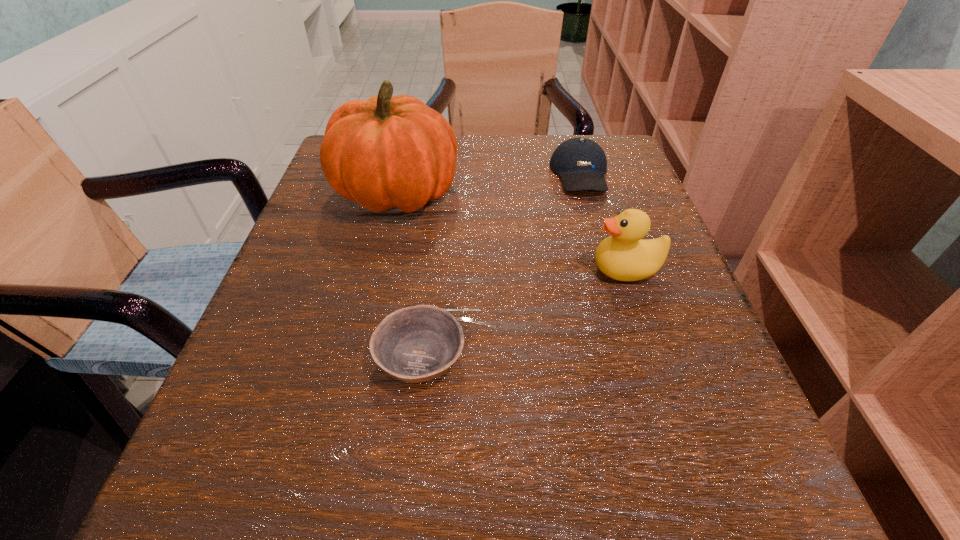
Locate an element on the screen. free space at the near edge is located at coordinates (396, 470).

Find the location of a particular element. This screenshot has width=960, height=540. vacant region at the left edge of the desktop is located at coordinates (287, 332).

In the image, there is a desktop. At what (x,y) coordinates should I click in order to perform the action: click on vacant space at the right edge. Please return your answer as a coordinate pair (x, y). Looking at the image, I should click on (587, 195).

Where is `vacant region at the near left corner of the desktop`? vacant region at the near left corner of the desktop is located at coordinates (198, 470).

In order to click on blank space at the far right corner of the desktop in this screenshot , I will do `click(605, 150)`.

In the image, there is a desktop. In order to click on free space at the near right corner in this screenshot , I will do `click(643, 478)`.

Identify the location of blank region between the nearest object and the tallest object. click(x=408, y=275).

This screenshot has width=960, height=540. In order to click on vacant area between the baseball cap and the duck in this screenshot , I will do `click(603, 221)`.

This screenshot has height=540, width=960. Find the location of `vacant space in between the nearest object and the second shortest object`. vacant space in between the nearest object and the second shortest object is located at coordinates (500, 266).

Where is `vacant point located between the second tallest object and the pumpkin`? This screenshot has height=540, width=960. vacant point located between the second tallest object and the pumpkin is located at coordinates (512, 231).